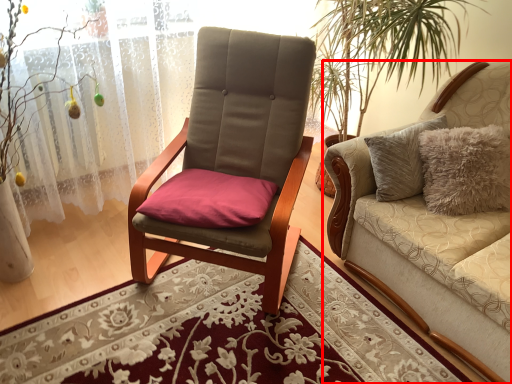
Question: In this image, where is studio couch (annotated by the red box) located relative to curtain?

Choices:
 (A) right
 (B) left

Answer: (A)